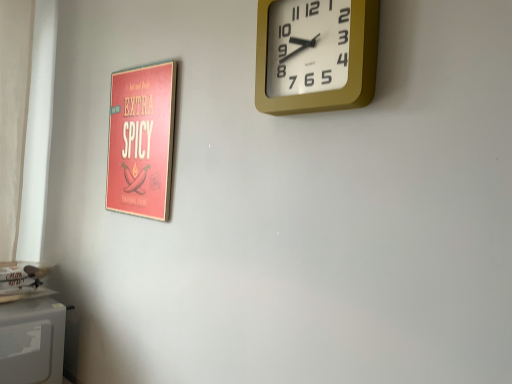
Question: From a real-world perspective, is matte red poster at left over white matte microwave at lower left?

Choices:
 (A) yes
 (B) no

Answer: (A)

Question: From the image's perspective, is matte red poster at left on top of white matte microwave at lower left?

Choices:
 (A) no
 (B) yes

Answer: (B)

Question: Is matte red poster at left taller than white matte microwave at lower left?

Choices:
 (A) yes
 (B) no

Answer: (A)

Question: Is matte red poster at left to the right of white matte microwave at lower left from the viewer's perspective?

Choices:
 (A) yes
 (B) no

Answer: (A)

Question: Is matte red poster at left shorter than white matte microwave at lower left?

Choices:
 (A) yes
 (B) no

Answer: (B)

Question: Relative to white matte microwave at lower left, is gold metallic wall clock at upper right in front or behind?

Choices:
 (A) behind
 (B) front

Answer: (B)

Question: Visually, is gold metallic wall clock at upper right positioned to the left or to the right of white matte microwave at lower left?

Choices:
 (A) left
 (B) right

Answer: (B)

Question: Looking at the image, does gold metallic wall clock at upper right seem bigger or smaller compared to white matte microwave at lower left?

Choices:
 (A) small
 (B) big

Answer: (A)

Question: From a real-world perspective, relative to white matte microwave at lower left, is gold metallic wall clock at upper right vertically above or below?

Choices:
 (A) above
 (B) below

Answer: (A)

Question: Based on their positions, is white matte microwave at lower left located to the left or right of gold metallic wall clock at upper right?

Choices:
 (A) right
 (B) left

Answer: (B)

Question: In terms of height, does white matte microwave at lower left look taller or shorter compared to gold metallic wall clock at upper right?

Choices:
 (A) short
 (B) tall

Answer: (B)

Question: Considering the positions of white matte microwave at lower left and gold metallic wall clock at upper right in the image, is white matte microwave at lower left wider or thinner than gold metallic wall clock at upper right?

Choices:
 (A) thin
 (B) wide

Answer: (B)

Question: From a real-world perspective, relative to gold metallic wall clock at upper right, is white matte microwave at lower left vertically above or below?

Choices:
 (A) below
 (B) above

Answer: (A)

Question: From the image's perspective, is white matte microwave at lower left positioned above or below matte red poster at left?

Choices:
 (A) above
 (B) below

Answer: (B)

Question: Considering the positions of white matte microwave at lower left and matte red poster at left in the image, is white matte microwave at lower left taller or shorter than matte red poster at left?

Choices:
 (A) short
 (B) tall

Answer: (A)